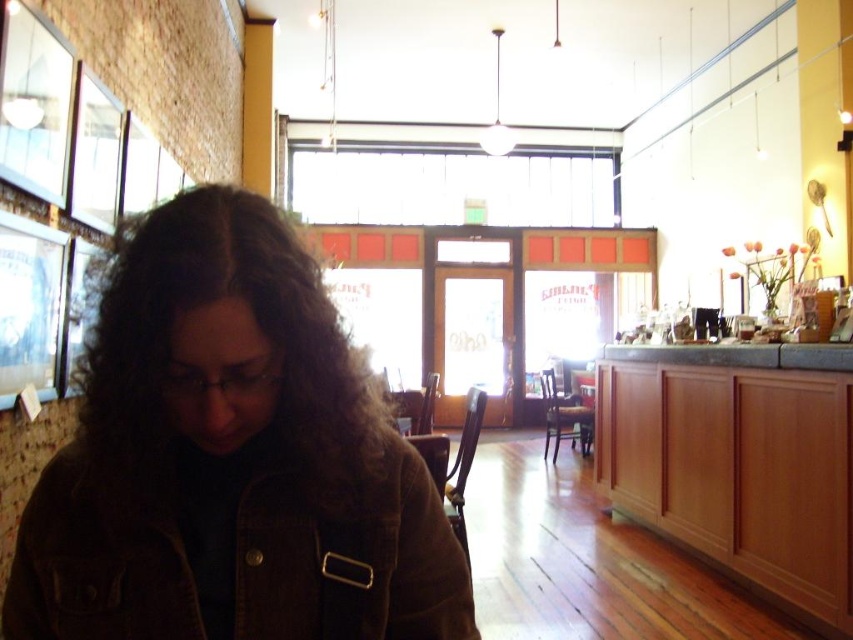
Between brown suede jacket at lower left and wooden cabinet at lower right, which one is positioned higher?

brown suede jacket at lower left

Is point (263, 406) closer to viewer compared to point (677, 413)?

Yes, point (263, 406) is closer to viewer.

The width and height of the screenshot is (853, 640). What are the coordinates of `brown suede jacket at lower left` in the screenshot? It's located at (231, 458).

The height and width of the screenshot is (640, 853). What are the coordinates of `brown suede jacket at lower left` in the screenshot? It's located at (231, 458).